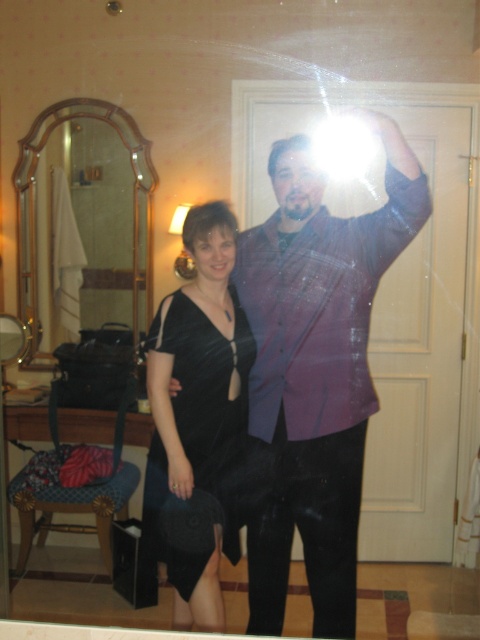
Who is more distant from viewer, [305,433] or [240,403]?

Point [240,403]

Does black satin dress at left have a smaller size compared to black velvet dress at center?

No, black satin dress at left is not smaller than black velvet dress at center.

The height and width of the screenshot is (640, 480). What do you see at coordinates (316, 369) in the screenshot?
I see `black satin dress at left` at bounding box center [316, 369].

This screenshot has height=640, width=480. I want to click on black satin dress at left, so click(316, 369).

Describe the element at coordinates (85, 218) in the screenshot. I see `gold-framed mirror at left` at that location.

Based on the photo, is gold-framed mirror at left smaller than black velvet dress at center?

No, gold-framed mirror at left is not smaller than black velvet dress at center.

Locate an element on the screen. Image resolution: width=480 pixels, height=640 pixels. gold-framed mirror at left is located at coordinates (85, 218).

At what (x,y) coordinates should I click in order to perform the action: click on gold-framed mirror at left. Please return your answer as a coordinate pair (x, y). This screenshot has height=640, width=480. Looking at the image, I should click on (85, 218).

Between black satin dress at left and gold-framed mirror at left, which one has more height?

black satin dress at left is taller.

Is point (315, 440) positioned behind point (33, 348)?

No.

Find the location of a particular element. This screenshot has width=480, height=640. black satin dress at left is located at coordinates (316, 369).